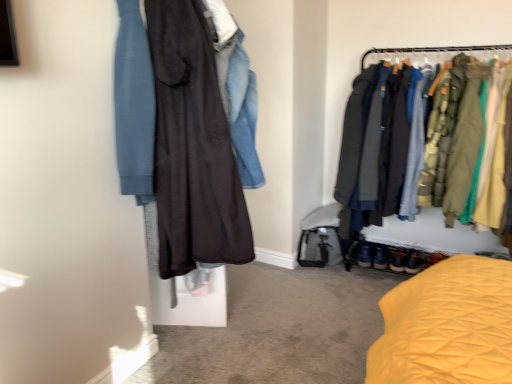
This screenshot has height=384, width=512. Identify the location of dark matte dress at center. (193, 146).

What do you see at coordinates (414, 262) in the screenshot? I see `leather brown shoes at lower right` at bounding box center [414, 262].

Find the location of a particular element. The height and width of the screenshot is (384, 512). textured fabric jackets at right is located at coordinates (433, 51).

Relative to leather brown shoes at lower right, is dark matte dress at center in front or behind?

dark matte dress at center is positioned closer to the viewer than leather brown shoes at lower right.

Is leather brown shoes at lower right inside dark matte dress at center?

No.

From a real-world perspective, is dark matte dress at center on leather brown shoes at lower right?

Indeed, from a real-world perspective, dark matte dress at center stands above leather brown shoes at lower right.

Based on the photo, is dark matte dress at center facing away from leather brown shoes at lower right?

No, dark matte dress at center's orientation is not away from leather brown shoes at lower right.

What's the angular difference between textured fabric jackets at right and leather brown shoes at lower right's facing directions?

0.994 degrees.

Which object is more forward, textured fabric jackets at right or leather brown shoes at lower right?

textured fabric jackets at right is more forward.

Would you say textured fabric jackets at right is to the left or to the right of leather brown shoes at lower right in the picture?

Clearly, textured fabric jackets at right is on the left of leather brown shoes at lower right in the image.

Could you tell me if textured fabric jackets at right is turned towards leather brown shoes at lower right?

Yes, textured fabric jackets at right is aimed at leather brown shoes at lower right.

Considering the positions of objects dark matte dress at center and textured fabric jackets at right in the image provided, who is more to the left, dark matte dress at center or textured fabric jackets at right?

dark matte dress at center.

Considering the points (216, 262) and (398, 59), which point is in front, point (216, 262) or point (398, 59)?

The point (216, 262) is closer.

Is dark matte dress at center further to camera compared to textured fabric jackets at right?

No, dark matte dress at center is closer to the viewer.

Who is shorter, dark matte dress at center or textured fabric jackets at right?

Standing shorter between the two is dark matte dress at center.

Where is `closet above the leather brown shoes at lower right (from the image's perspective)`? closet above the leather brown shoes at lower right (from the image's perspective) is located at coordinates (433, 51).

Could you tell me if leather brown shoes at lower right is turned towards textured fabric jackets at right?

Yes.

Is leather brown shoes at lower right inside or outside of textured fabric jackets at right?

leather brown shoes at lower right exists entirely within textured fabric jackets at right.

Is point (414, 261) less distant than point (480, 52)?

No, it is not.

Who is taller, leather brown shoes at lower right or dark matte dress at center?

dark matte dress at center is taller.

Does leather brown shoes at lower right come behind dark matte dress at center?

That is True.

At what (x,y) coordinates should I click in order to perform the action: click on footwear below the dark matte dress at center (from a real-world perspective). Please return your answer as a coordinate pair (x, y). Image resolution: width=512 pixels, height=384 pixels. Looking at the image, I should click on [x=414, y=262].

From the image's perspective, is leather brown shoes at lower right positioned above or below dark matte dress at center?

leather brown shoes at lower right is situated lower than dark matte dress at center in the image.

Is textured fabric jackets at right facing away from dark matte dress at center?

No, textured fabric jackets at right is not facing the opposite direction of dark matte dress at center.

Between textured fabric jackets at right and dark matte dress at center, which one has larger size?

textured fabric jackets at right is bigger.

Is textured fabric jackets at right directly adjacent to dark matte dress at center?

No, textured fabric jackets at right is not making contact with dark matte dress at center.

Is the depth of textured fabric jackets at right less than that of dark matte dress at center?

No, textured fabric jackets at right is further to the viewer.

Identify the location of footwear located on the right of dark matte dress at center. This screenshot has width=512, height=384. (414, 262).

You are a GUI agent. You are given a task and a screenshot of the screen. Output one action in this format:
    pyautogui.click(x=<x>, y=<y>)
    Task: Click on the closet above the leather brown shoes at lower right (from a real-world perspective)
    
    Given the screenshot: What is the action you would take?
    pyautogui.click(x=433, y=51)

Based on their spatial positions, is dark matte dress at center or leather brown shoes at lower right closer to textured fabric jackets at right?

leather brown shoes at lower right is positioned closer to the anchor textured fabric jackets at right.

Based on their spatial positions, is leather brown shoes at lower right or dark matte dress at center closer to textured fabric jackets at right?

leather brown shoes at lower right is positioned closer to the anchor textured fabric jackets at right.

Looking at the image, which one is located further to leather brown shoes at lower right, dark matte dress at center or textured fabric jackets at right?

Based on the image, dark matte dress at center appears to be further to leather brown shoes at lower right.

Estimate the real-world distances between objects in this image. Which object is closer to leather brown shoes at lower right, textured fabric jackets at right or dark matte dress at center?

textured fabric jackets at right is closer to leather brown shoes at lower right.

Which object lies further to the anchor point dark matte dress at center, leather brown shoes at lower right or textured fabric jackets at right?

Among the two, leather brown shoes at lower right is located further to dark matte dress at center.

Which object lies nearer to the anchor point dark matte dress at center, textured fabric jackets at right or leather brown shoes at lower right?

Based on the image, textured fabric jackets at right appears to be nearer to dark matte dress at center.

Where is `closet located between dark matte dress at center and leather brown shoes at lower right in the left-right direction`? The image size is (512, 384). closet located between dark matte dress at center and leather brown shoes at lower right in the left-right direction is located at coordinates (433, 51).